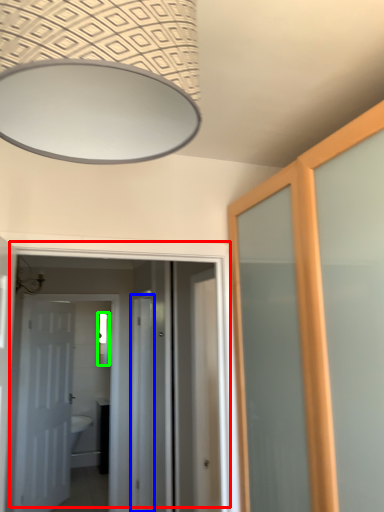
Question: Based on their relative distances, which object is nearer to door (highlighted by a red box)? Choose from screen door (highlighted by a blue box) and mirror (highlighted by a green box).

Choices:
 (A) screen door
 (B) mirror

Answer: (A)